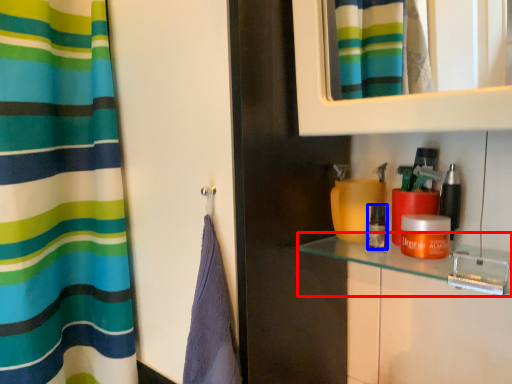
Question: Which object appears farthest to the camera in this image, counter top (highlighted by a red box) or cosmetic (highlighted by a blue box)?

Choices:
 (A) counter top
 (B) cosmetic

Answer: (B)